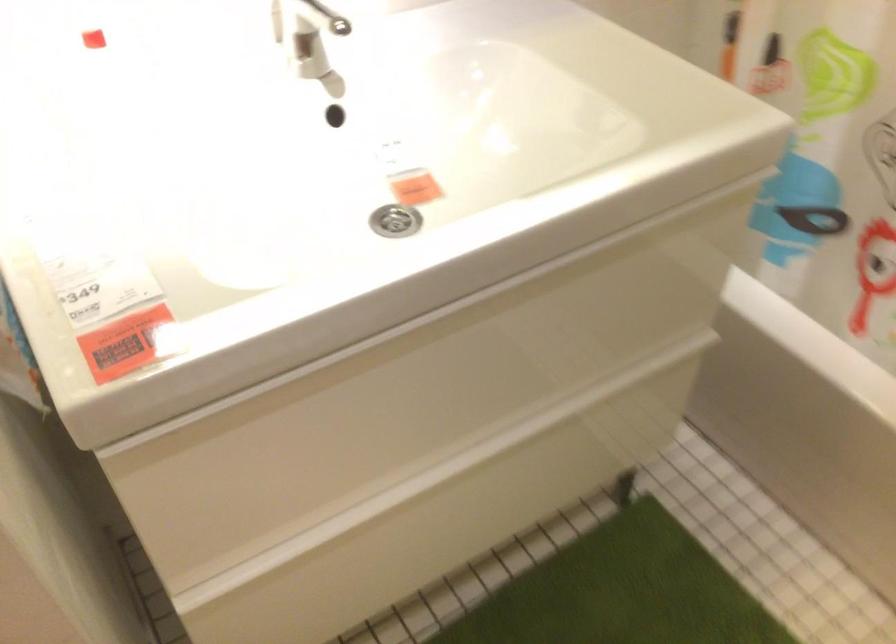
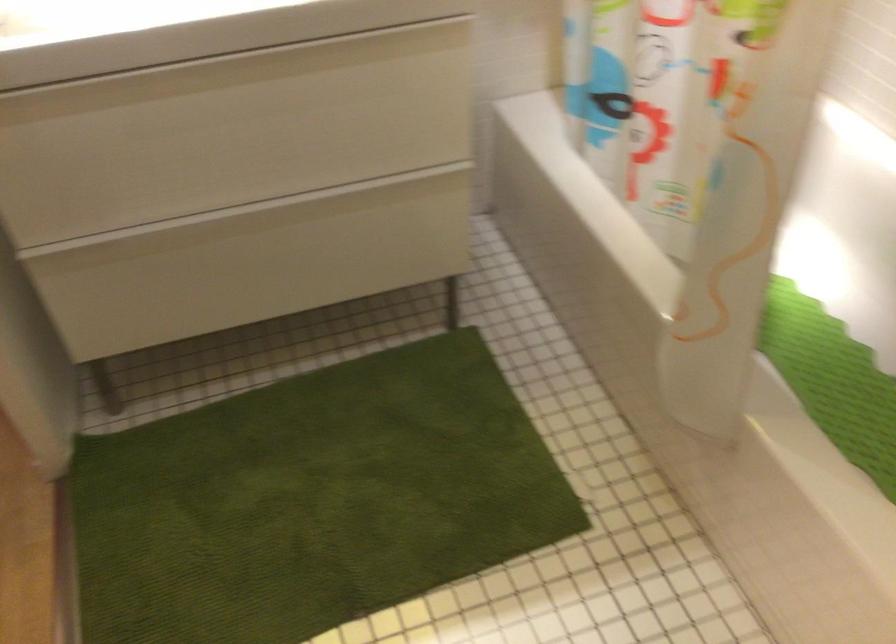
Which direction would the cameraman need to move to produce the second image?

The cameraman moved toward right, backward.